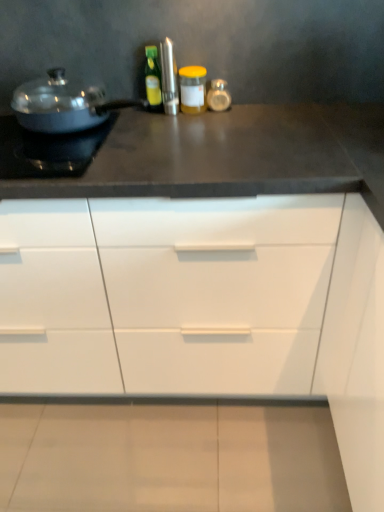
Question: Is yellow matte jar at center, arranged as the 2th bottle when viewed from the left, shorter than shiny metallic pot at left?

Choices:
 (A) yes
 (B) no

Answer: (A)

Question: Is yellow matte jar at center, which ranks as the first bottle in right-to-left order, to the left of shiny metallic pot at left from the viewer's perspective?

Choices:
 (A) no
 (B) yes

Answer: (A)

Question: From the image's perspective, is yellow matte jar at center, which ranks as the first bottle in right-to-left order, below shiny metallic pot at left?

Choices:
 (A) yes
 (B) no

Answer: (B)

Question: Considering the relative sizes of yellow matte jar at center, arranged as the 2th bottle when viewed from the left, and shiny metallic pot at left in the image provided, is yellow matte jar at center, arranged as the 2th bottle when viewed from the left, thinner than shiny metallic pot at left?

Choices:
 (A) yes
 (B) no

Answer: (A)

Question: Does yellow matte jar at center, arranged as the 2th bottle when viewed from the left, have a greater height compared to shiny metallic pot at left?

Choices:
 (A) yes
 (B) no

Answer: (B)

Question: From a real-world perspective, relative to matte black pan at left, is yellow matte jar at center, which ranks as the first bottle in right-to-left order, vertically above or below?

Choices:
 (A) below
 (B) above

Answer: (B)

Question: Is yellow matte jar at center, arranged as the 2th bottle when viewed from the left, in front of or behind matte black pan at left in the image?

Choices:
 (A) behind
 (B) front

Answer: (A)

Question: Based on their sizes in the image, would you say yellow matte jar at center, arranged as the 2th bottle when viewed from the left, is bigger or smaller than matte black pan at left?

Choices:
 (A) small
 (B) big

Answer: (A)

Question: From the image's perspective, is yellow matte jar at center, which ranks as the first bottle in right-to-left order, positioned above or below matte black pan at left?

Choices:
 (A) above
 (B) below

Answer: (A)

Question: Is shiny metallic pot at left in front of or behind yellow matte jar at center, which ranks as the first bottle in right-to-left order, in the image?

Choices:
 (A) behind
 (B) front

Answer: (B)

Question: Visually, is shiny metallic pot at left positioned to the left or to the right of yellow matte jar at center, which ranks as the first bottle in right-to-left order?

Choices:
 (A) left
 (B) right

Answer: (A)

Question: Looking at their shapes, would you say shiny metallic pot at left is wider or thinner than yellow matte jar at center, arranged as the 2th bottle when viewed from the left?

Choices:
 (A) thin
 (B) wide

Answer: (B)

Question: Looking at the image, does shiny metallic pot at left seem bigger or smaller compared to yellow matte jar at center, which ranks as the first bottle in right-to-left order?

Choices:
 (A) small
 (B) big

Answer: (B)

Question: From the image's perspective, is green glass bottle at center, which is the 2th bottle in right-to-left order, located above or below white matte cabinet at center?

Choices:
 (A) below
 (B) above

Answer: (B)

Question: Based on their sizes in the image, would you say green glass bottle at center, acting as the 1th bottle starting from the left, is bigger or smaller than white matte cabinet at center?

Choices:
 (A) big
 (B) small

Answer: (B)